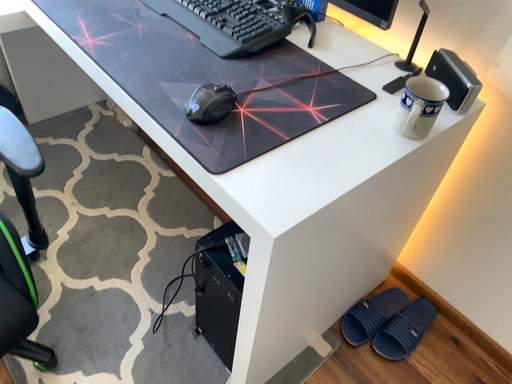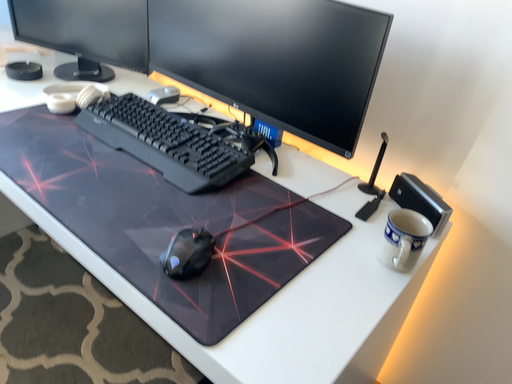
Question: How did the camera likely rotate when shooting the video?

Choices:
 (A) rotated left
 (B) rotated right

Answer: (B)